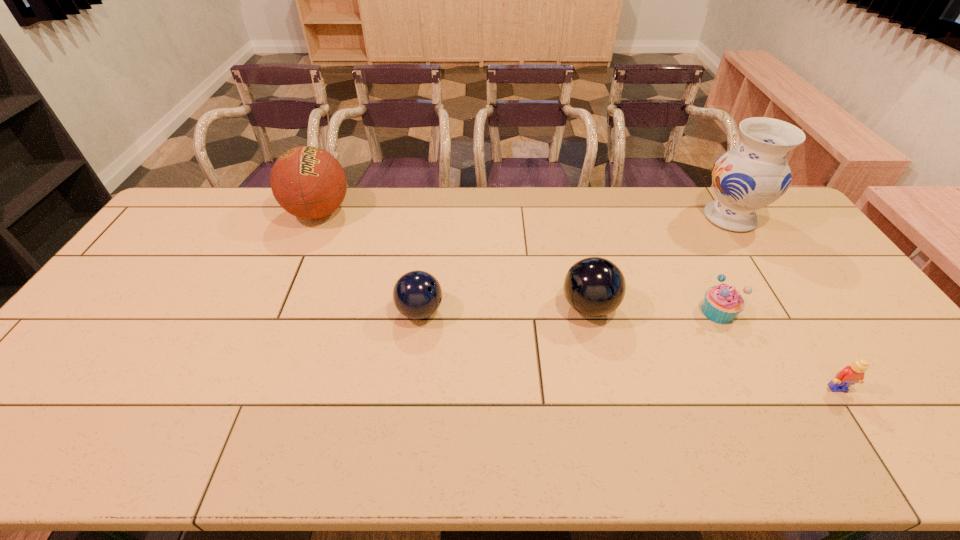
At what (x,y) coordinates should I click in order to perform the action: click on free space between the tallest object and the basketball. Please return your answer as a coordinate pair (x, y). Looking at the image, I should click on (524, 215).

The width and height of the screenshot is (960, 540). Find the location of `empty space that is in between the fifth object from right to left and the Lego`. empty space that is in between the fifth object from right to left and the Lego is located at coordinates (629, 349).

Identify the location of free space between the muffin and the Lego. This screenshot has width=960, height=540. tap(778, 350).

Image resolution: width=960 pixels, height=540 pixels. In order to click on vacant space in between the taller bowling ball and the second object from left to right in this screenshot , I will do `click(505, 309)`.

Select which object appears as the closest to the muffin. Please provide its 2D coordinates. Your answer should be formatted as a tuple, i.e. [(x, y)], where the tuple contains the x and y coordinates of a point satisfying the conditions above.

[(852, 374)]

I want to click on the third closest object to the Lego, so click(x=754, y=174).

Identify the location of vacant space that satisfies the following two spatial constraints: 1. on the front side of the muffin; 2. on the left side of the basketball. (276, 312).